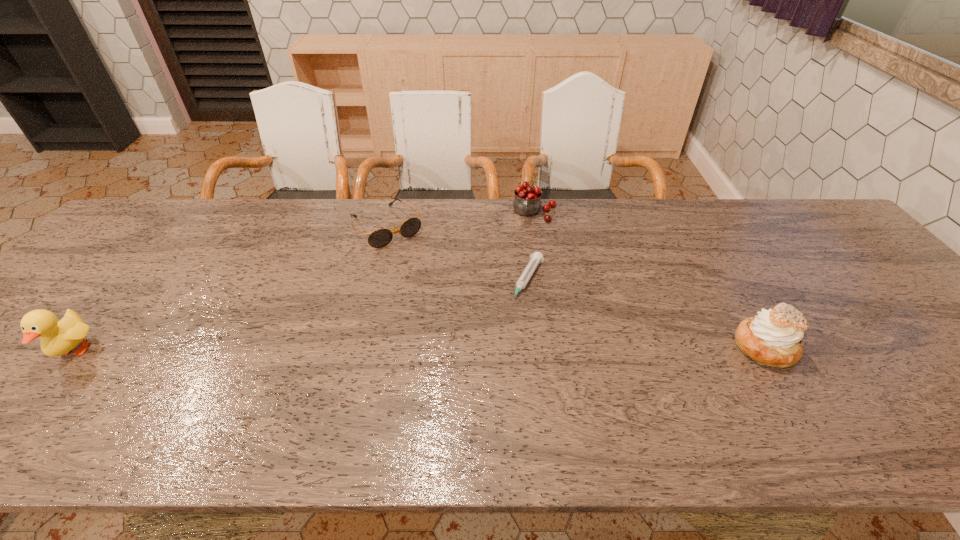
Identify the location of vacant space in between the pot filled with cherries and the syringe. The height and width of the screenshot is (540, 960). (530, 247).

Find the location of a particular element. The image size is (960, 540). free area in between the leftmost object and the sunglasses is located at coordinates (230, 289).

I want to click on vacant area that lies between the third farthest object and the second shortest object, so click(x=457, y=254).

The width and height of the screenshot is (960, 540). In order to click on free space between the leftmost object and the fourth tallest object in this screenshot , I will do `click(230, 289)`.

The height and width of the screenshot is (540, 960). I want to click on free space between the pot filled with cherries and the pastry, so click(649, 280).

Locate an element on the screen. Image resolution: width=960 pixels, height=540 pixels. free spot between the pot filled with cherries and the leftmost object is located at coordinates click(303, 282).

At what (x,y) coordinates should I click in order to perform the action: click on empty space that is in between the fourth tallest object and the pot filled with cherries. Please return your answer as a coordinate pair (x, y). The image size is (960, 540). Looking at the image, I should click on (460, 220).

Where is `free space between the pastry and the leftmost object`? free space between the pastry and the leftmost object is located at coordinates (420, 349).

You are a GUI agent. You are given a task and a screenshot of the screen. Output one action in this format:
    pyautogui.click(x=<x>, y=<y>)
    Task: Click on the vacant space in between the third nearest object and the pastry
    
    Given the screenshot: What is the action you would take?
    pyautogui.click(x=646, y=314)

Select which object is the fourth closest to the third nearest object. Please provide its 2D coordinates. Your answer should be formatted as a tuple, i.e. [(x, y)], where the tuple contains the x and y coordinates of a point satisfying the conditions above.

[(58, 338)]